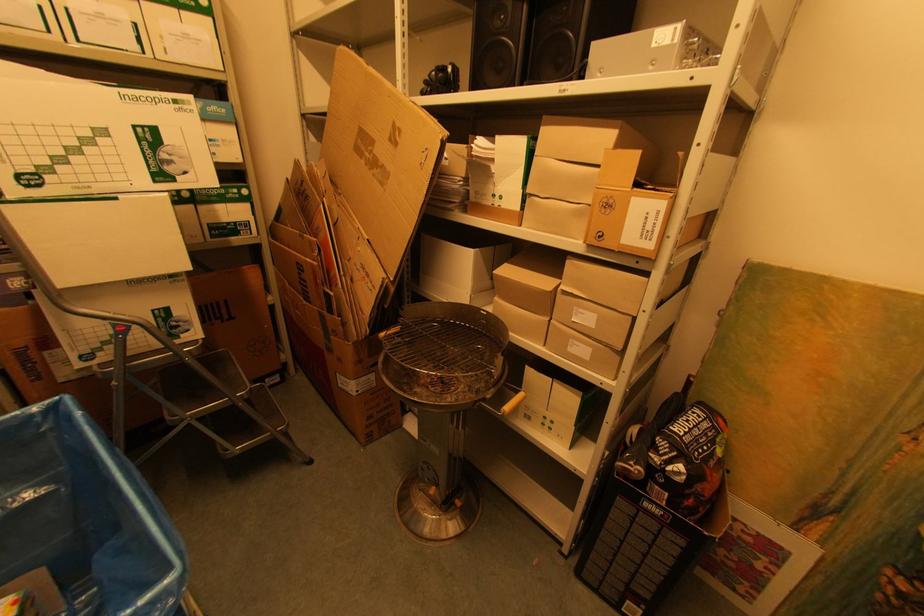
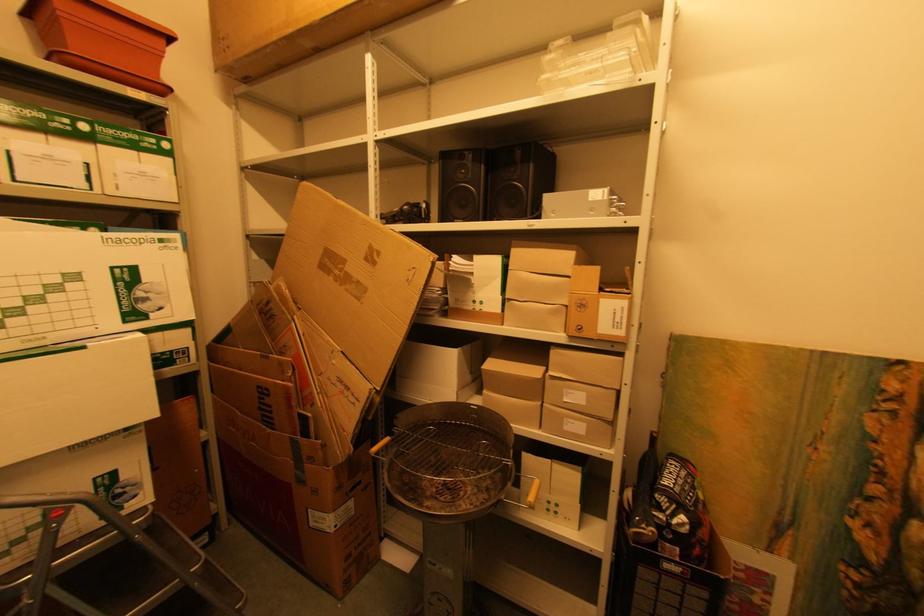
Question: What movement of the cameraman would produce the second image?

Choices:
 (A) Left
 (B) Right
 (C) Forward
 (D) Backward

Answer: (A)